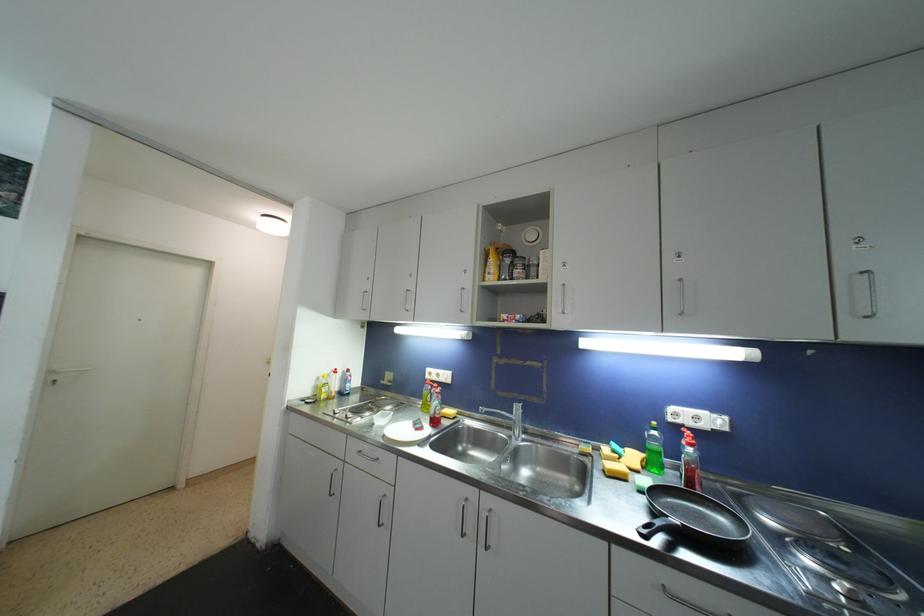
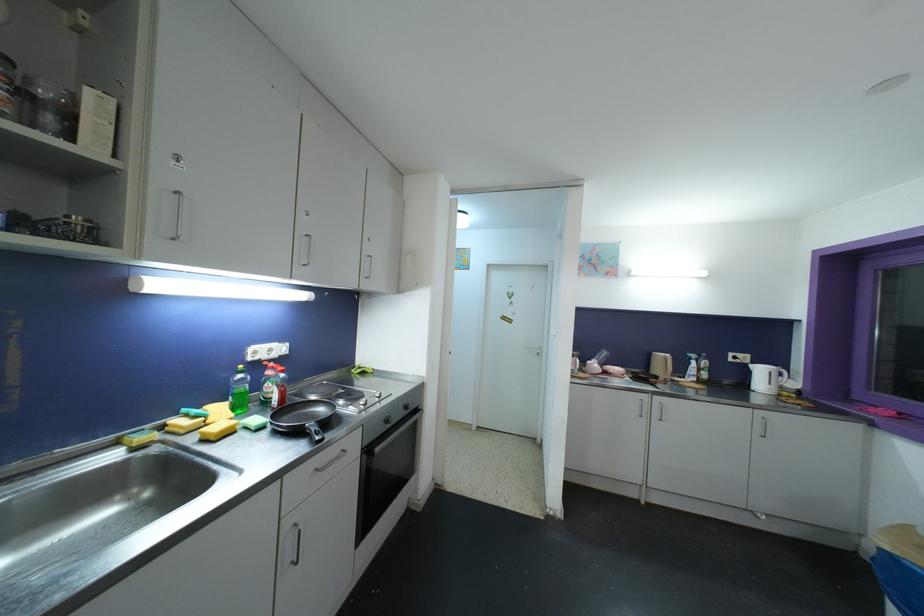
Where in the second image is the point corresponding to [695,448] from the first image?

(286, 374)